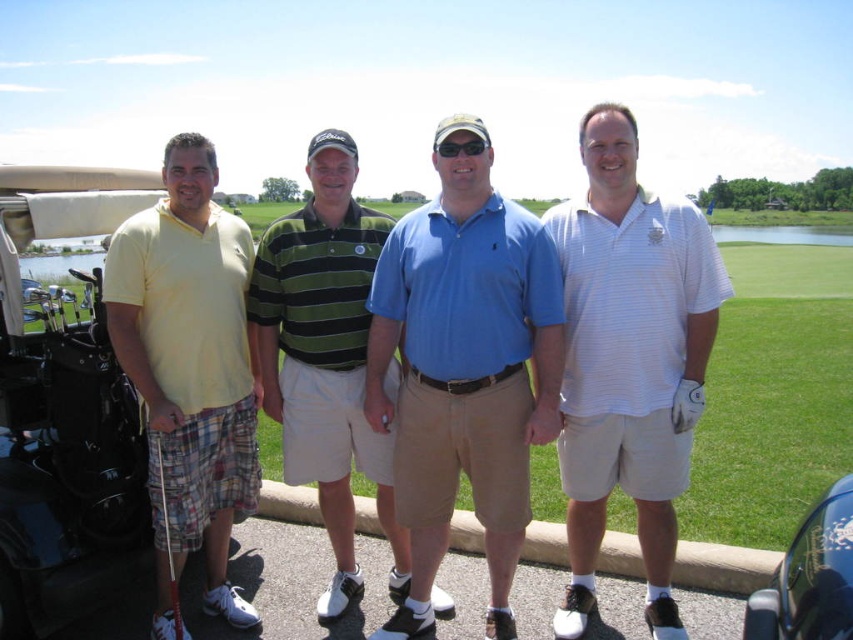
Question: Which object is positioned farthest from the matte black golf cart at left?

Choices:
 (A) blue cotton polo shirt at center
 (B) white plastic golf club at lower left
 (C) green striped polo shirt at center
 (D) green grass at center

Answer: (D)

Question: Does blue cotton polo shirt at center have a smaller size compared to white striped polo shirt at center?

Choices:
 (A) yes
 (B) no

Answer: (A)

Question: Which point appears closest to the camera in this image?

Choices:
 (A) (589, 394)
 (B) (466, 440)
 (C) (158, 282)

Answer: (B)

Question: Is green grass at center closer to camera compared to matte black golf cart at left?

Choices:
 (A) no
 (B) yes

Answer: (B)

Question: Does green grass at center have a greater width compared to green striped polo shirt at center?

Choices:
 (A) no
 (B) yes

Answer: (B)

Question: Which point appears closest to the camera in this image?

Choices:
 (A) (302, 296)
 (B) (612, 433)
 (C) (190, 234)
 (D) (413, 349)

Answer: (D)